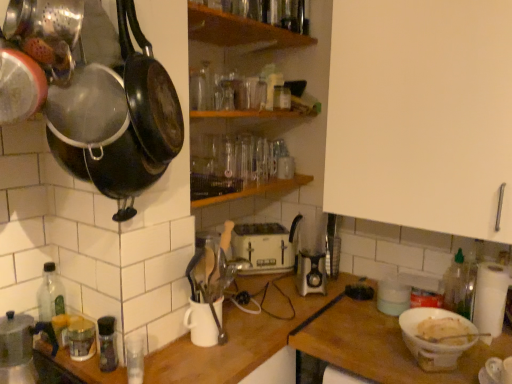
Image resolution: width=512 pixels, height=384 pixels. What are the coordinates of `free point below black matte frying pan at left, which is the second frying pan from right to left (from a real-world perspective)` in the screenshot? It's located at (161, 366).